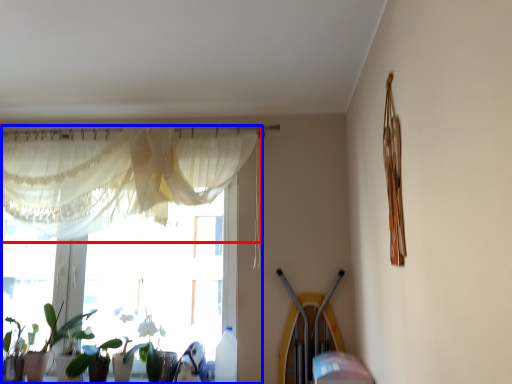
Question: Which object appears farthest to the camera in this image, curtain (highlighted by a red box) or window (highlighted by a blue box)?

Choices:
 (A) curtain
 (B) window

Answer: (B)